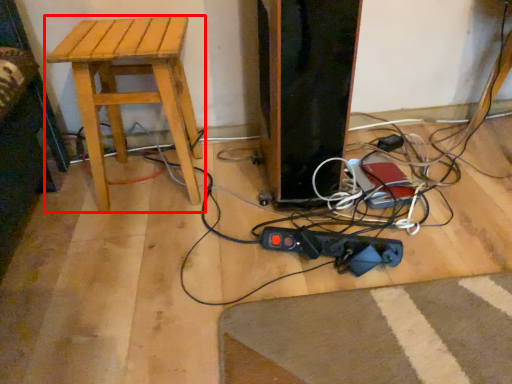
Question: From the image's perspective, what is the correct spatial positioning of stool (annotated by the red box) in reference to plug?

Choices:
 (A) below
 (B) above

Answer: (B)